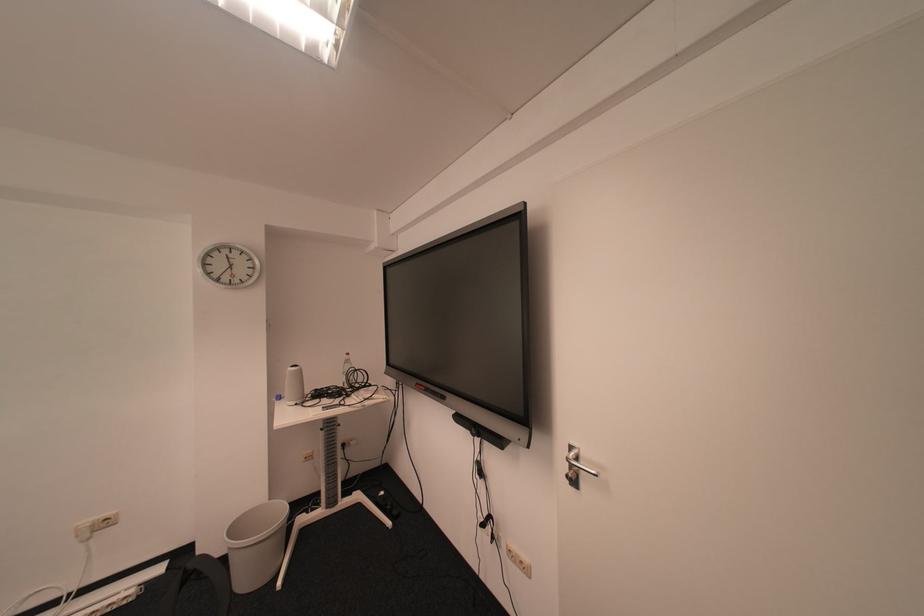
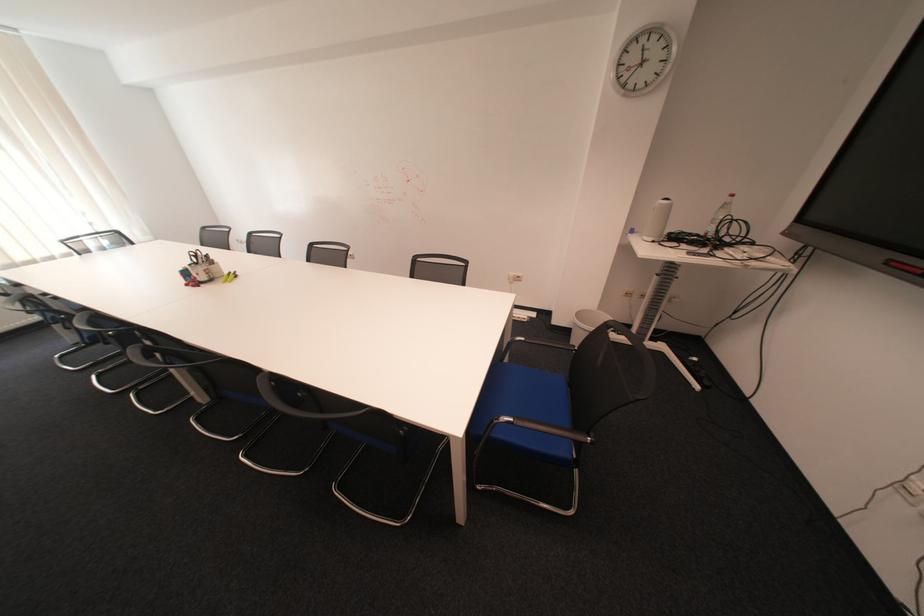
Where in the second image is the point corresponding to point 290,398 from the first image?

(643, 232)